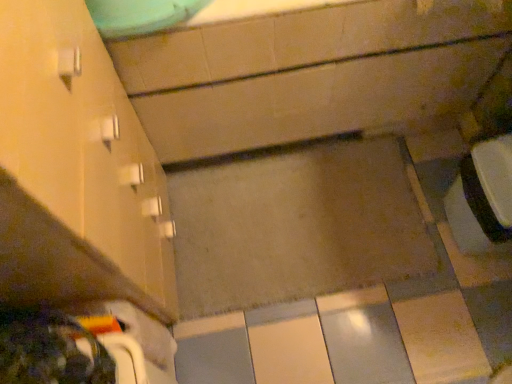
Question: From a real-world perspective, does matte ceramic bathtub at center sit lower than matte white cabinet at left?

Choices:
 (A) yes
 (B) no

Answer: (A)

Question: From the image's perspective, is matte ceramic bathtub at center located above matte white cabinet at left?

Choices:
 (A) yes
 (B) no

Answer: (A)

Question: Is matte ceramic bathtub at center bigger than matte white cabinet at left?

Choices:
 (A) yes
 (B) no

Answer: (A)

Question: From a real-world perspective, is matte ceramic bathtub at center on top of matte white cabinet at left?

Choices:
 (A) yes
 (B) no

Answer: (B)

Question: Does matte ceramic bathtub at center turn towards matte white cabinet at left?

Choices:
 (A) no
 (B) yes

Answer: (B)

Question: From the image's perspective, is matte ceramic bathtub at center beneath matte white cabinet at left?

Choices:
 (A) yes
 (B) no

Answer: (B)

Question: Is matte white cabinet at left positioned before matte ceramic bathtub at center?

Choices:
 (A) yes
 (B) no

Answer: (A)

Question: Can you confirm if matte white cabinet at left is shorter than matte ceramic bathtub at center?

Choices:
 (A) no
 (B) yes

Answer: (A)

Question: Is there a large distance between matte white cabinet at left and matte ceramic bathtub at center?

Choices:
 (A) yes
 (B) no

Answer: (B)

Question: Is matte white cabinet at left taller than matte ceramic bathtub at center?

Choices:
 (A) no
 (B) yes

Answer: (B)

Question: From a real-world perspective, does matte white cabinet at left sit lower than matte ceramic bathtub at center?

Choices:
 (A) yes
 (B) no

Answer: (B)

Question: Can matte ceramic bathtub at center be found inside matte white cabinet at left?

Choices:
 (A) yes
 (B) no

Answer: (B)

Question: From the image's perspective, relative to matte white cabinet at left, is matte ceramic bathtub at center above or below?

Choices:
 (A) below
 (B) above

Answer: (B)